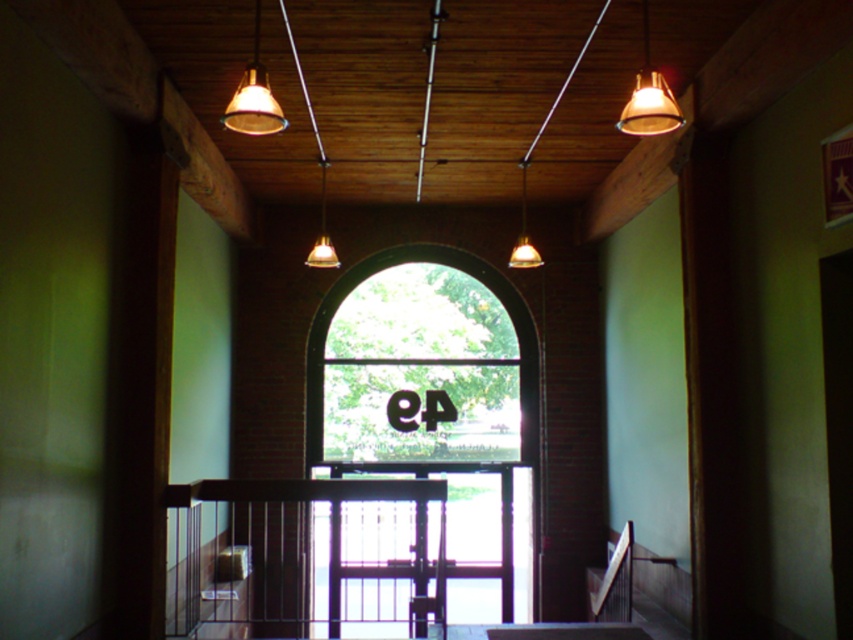
You are standing in the hallway and need to determine which object is bigger between the black metal balustrade at lower center and the matte glass light at upper center. Can you tell me which one is larger?

The black metal balustrade at lower center is larger in size than the matte glass light at upper center.

You are standing in the hallway and want to place a tall potted plant between the black metal balustrade at lower center and the matte glass light at upper center. Considering their heights, which object should the plant be placed closer to?

The black metal balustrade at lower center has a greater height compared to the matte glass light at upper center, so the plant should be placed closer to the matte glass light at upper center to maintain balance in height.

You are standing in the hallway and want to determine the relative positions of two points marked in the scene. Which point, point 1 at coordinates [521,256] or point 2 at [316,252], is closer to you?

Point 1 at coordinates [521,256] is closer to the viewer than point 2 at [316,252].